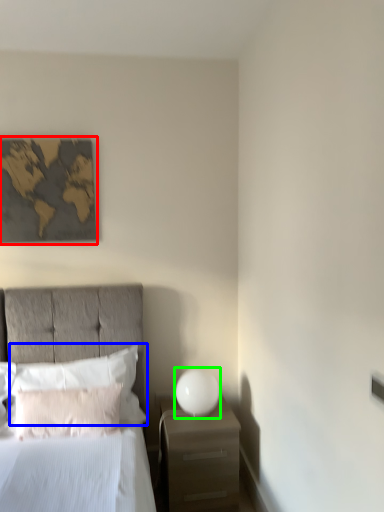
Question: Which object is positioned closest to picture frame (highlighted by a red box)? Select from pillow (highlighted by a blue box) and bedside lamp (highlighted by a green box).

Choices:
 (A) pillow
 (B) bedside lamp

Answer: (A)